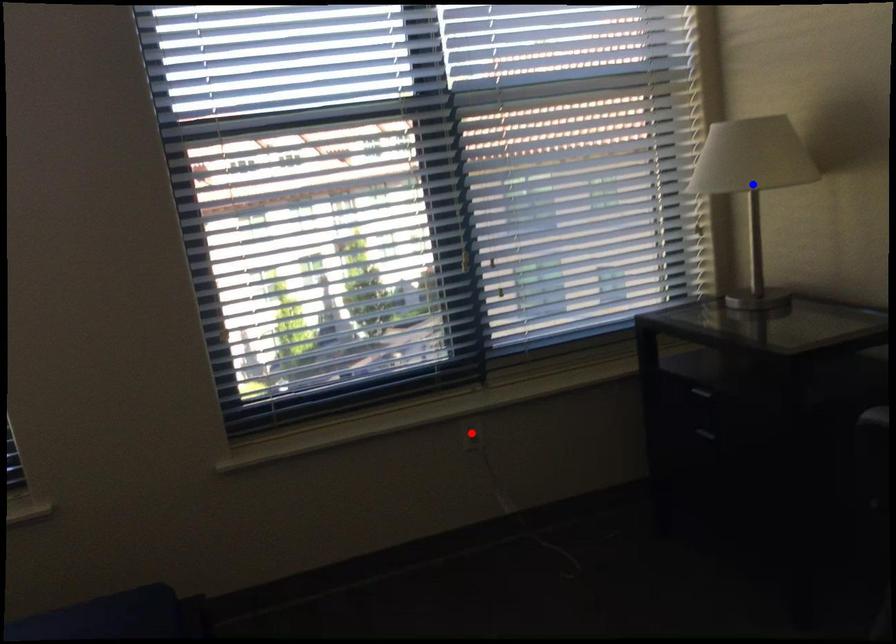
Question: In the image, two points are highlighted. Which point is nearer to the camera? Reply with the corresponding letter.

Choices:
 (A) blue point
 (B) red point

Answer: (A)